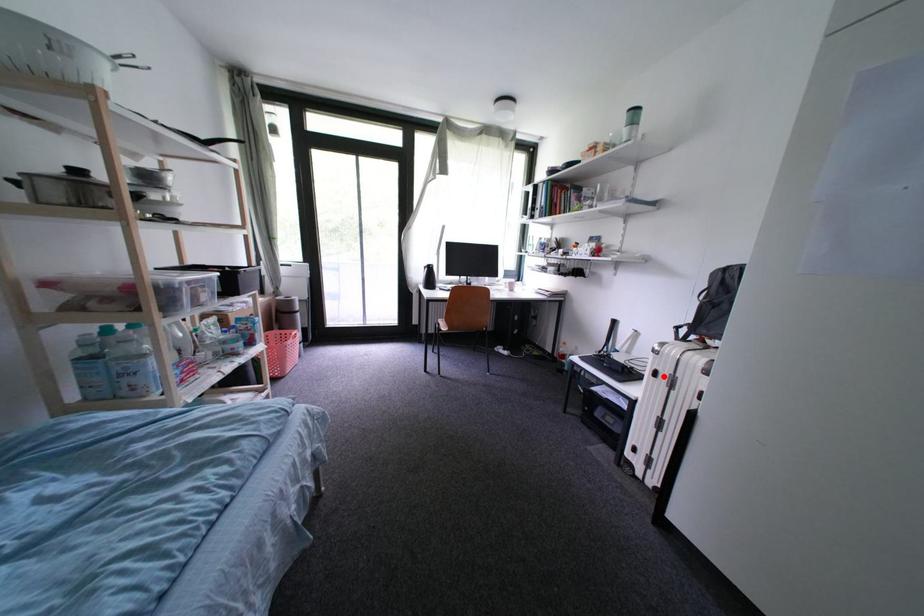
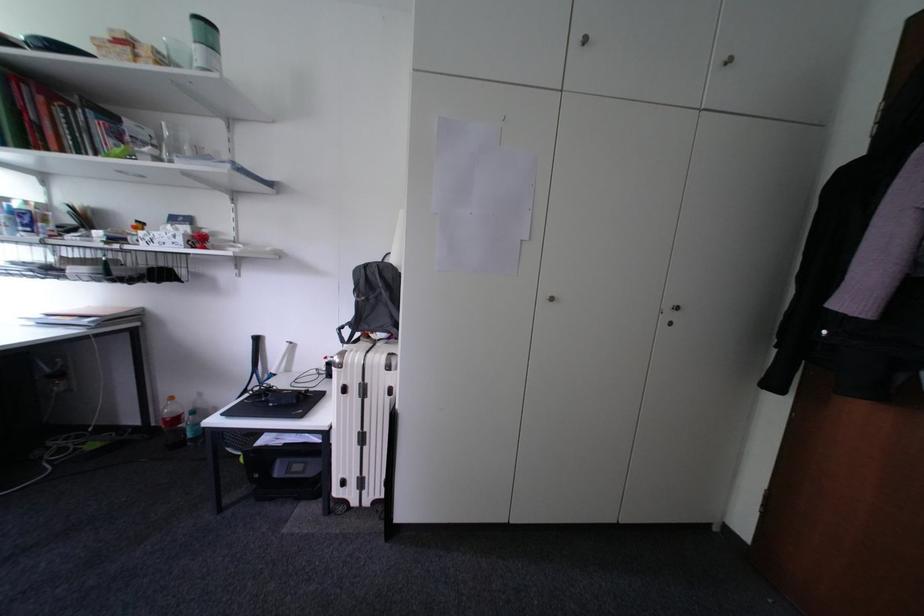
Find the pixel in the second image that matches the highlighted location in the first image.

(353, 392)